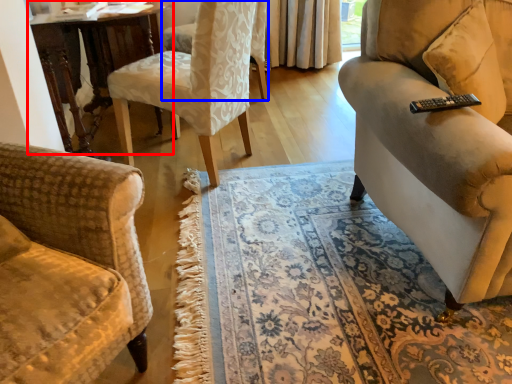
Question: Which object is closer to the camera taking this photo, table (highlighted by a red box) or chair (highlighted by a blue box)?

Choices:
 (A) table
 (B) chair

Answer: (A)